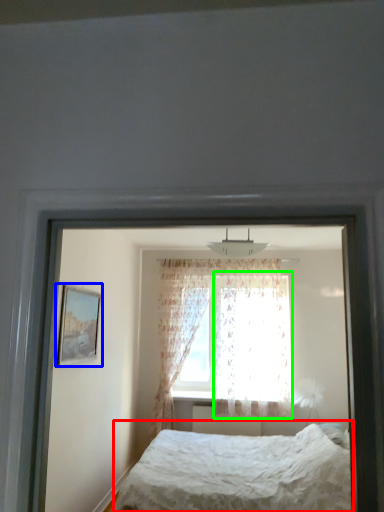
Question: Which is farther away from bed (highlighted by a red box)? picture frame (highlighted by a blue box) or curtain (highlighted by a green box)?

Choices:
 (A) picture frame
 (B) curtain

Answer: (B)